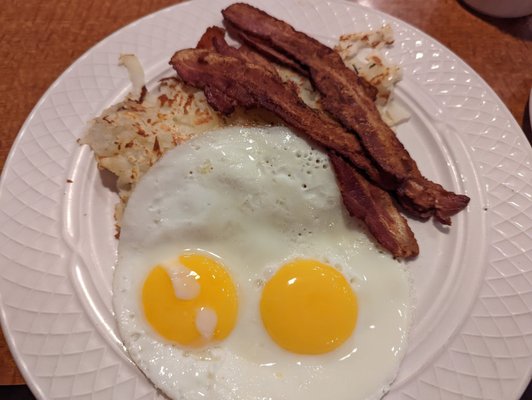
I want to click on table, so click(x=59, y=33).